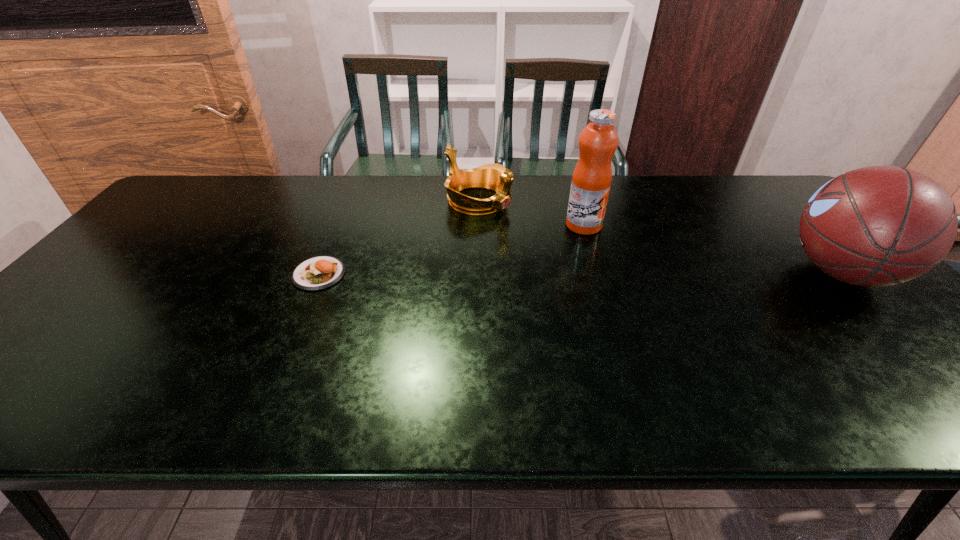
You are a GUI agent. You are given a task and a screenshot of the screen. Output one action in this format:
    pyautogui.click(x=<x>, y=<y>)
    Task: Click on the leftmost object
    
    Given the screenshot: What is the action you would take?
    pyautogui.click(x=321, y=272)

Image resolution: width=960 pixels, height=540 pixels. In order to click on the shortest object in this screenshot , I will do `click(321, 272)`.

Locate an element on the screen. The height and width of the screenshot is (540, 960). the rightmost object is located at coordinates (876, 226).

I want to click on basketball, so click(876, 226).

Where is `the second object from right to left`? The image size is (960, 540). the second object from right to left is located at coordinates [x=591, y=181].

Find the location of a particular element. This screenshot has height=540, width=960. fruit juice is located at coordinates (591, 181).

Image resolution: width=960 pixels, height=540 pixels. Identify the location of tiara. (496, 177).

Locate an element on the screen. The height and width of the screenshot is (540, 960). the second object from left to right is located at coordinates (496, 177).

I want to click on free location located 0.140m on the right of the patty (food), so click(397, 274).

Find the location of a particular element. Image resolution: width=960 pixels, height=540 pixels. vacant space positioned 0.350m on the left of the second tallest object is located at coordinates (655, 272).